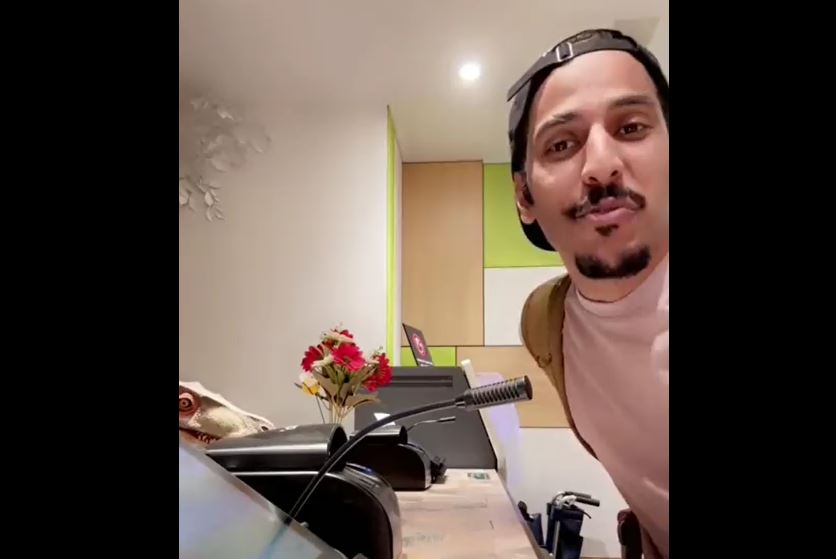
Where is `bouquet`? The width and height of the screenshot is (836, 559). bouquet is located at coordinates (342, 374).